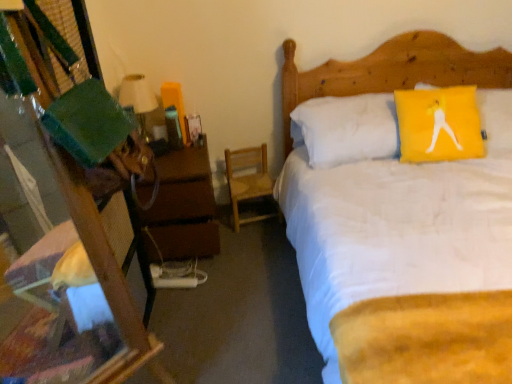
Identify the location of wooden desk at left. (56, 233).

What are the coordinates of `matte white lampshade at left` in the screenshot? It's located at (138, 100).

What do you see at coordinates (392, 70) in the screenshot? This screenshot has height=384, width=512. I see `white soft bed at upper right` at bounding box center [392, 70].

This screenshot has height=384, width=512. Find the location of `wooden chair at center`. wooden chair at center is located at coordinates (247, 180).

Locate an element on the screen. The width and height of the screenshot is (512, 384). wooden desk at left is located at coordinates (56, 233).

Consider the image. From the image's perspective, between brown wooden nightstand at left and white soft bed at upper right, which one is located above?

brown wooden nightstand at left.

Which object is thinner, brown wooden nightstand at left or white soft bed at upper right?

With smaller width is brown wooden nightstand at left.

From a real-world perspective, is brown wooden nightstand at left located beneath white soft bed at upper right?

Yes, from a real-world perspective, brown wooden nightstand at left is below white soft bed at upper right.

Does brown wooden nightstand at left have a smaller size compared to white soft bed at upper right?

Correct, brown wooden nightstand at left occupies less space than white soft bed at upper right.

How different are the orientations of wooden desk at left and wooden chair at center in degrees?

The angular difference between wooden desk at left and wooden chair at center is 36 degrees.

Is wooden desk at left positioned with its back to wooden chair at center?

No, wooden desk at left is not facing away from wooden chair at center.

Is wooden desk at left situated inside wooden chair at center or outside?

wooden desk at left cannot be found inside wooden chair at center.

From the image's perspective, is wooden desk at left beneath wooden chair at center?

Indeed, from the image's perspective, wooden desk at left is shown beneath wooden chair at center.

Could you tell me if wooden desk at left is facing white soft bed at upper right?

No, wooden desk at left is not turned towards white soft bed at upper right.

From a real-world perspective, between wooden desk at left and white soft bed at upper right, who is vertically lower?

white soft bed at upper right, from a real-world perspective.

From the image's perspective, which is below, wooden desk at left or white soft bed at upper right?

wooden desk at left is shown below in the image.

Is wooden desk at left to the right of white soft bed at upper right from the viewer's perspective?

In fact, wooden desk at left is to the left of white soft bed at upper right.

Which of these two, brown wooden nightstand at left or wooden chair at center, is bigger?

Bigger between the two is brown wooden nightstand at left.

Does brown wooden nightstand at left appear on the right side of wooden chair at center?

No.

At what (x,y) coordinates should I click in order to perform the action: click on chair on the right of the brown wooden nightstand at left. Please return your answer as a coordinate pair (x, y). Looking at the image, I should click on (247, 180).

Which is in front, matte white lampshade at left or wooden desk at left?

wooden desk at left is in front.

Are matte white lampshade at left and wooden desk at left located far from each other?

Yes.

The height and width of the screenshot is (384, 512). I want to click on desk in front of the matte white lampshade at left, so click(x=56, y=233).

Visually, is matte white lampshade at left positioned to the left or to the right of wooden desk at left?

matte white lampshade at left is positioned on wooden desk at left's left side.

Is point (146, 140) more distant than point (290, 107)?

No, it is in front of (290, 107).

From a real-world perspective, relative to white soft bed at upper right, is matte white lampshade at left vertically above or below?

In terms of real-world spatial position, matte white lampshade at left is above white soft bed at upper right.

From the image's perspective, which one is positioned higher, matte white lampshade at left or white soft bed at upper right?

matte white lampshade at left, from the image's perspective.

Is matte white lampshade at left facing towards white soft bed at upper right?

No, matte white lampshade at left is not oriented towards white soft bed at upper right.

Is wooden chair at center further to camera compared to white soft bed at upper right?

Yes.

Is wooden chair at center next to white soft bed at upper right?

No, wooden chair at center is not next to white soft bed at upper right.

Which of these two, wooden chair at center or white soft bed at upper right, stands shorter?

Standing shorter between the two is wooden chair at center.

Can you tell me how much wooden chair at center and white soft bed at upper right differ in facing direction?

10 degrees.

Locate an element on the screen. bed in front of the brown wooden nightstand at left is located at coordinates (392, 70).

At what (x,y) coordinates should I click in order to perform the action: click on chair below the wooden desk at left (from a real-world perspective). Please return your answer as a coordinate pair (x, y). The height and width of the screenshot is (384, 512). Looking at the image, I should click on (247, 180).

When comparing their distances from white soft bed at upper right, does matte white lampshade at left or wooden chair at center seem closer?

The object closer to white soft bed at upper right is wooden chair at center.

Considering their positions, is wooden chair at center positioned closer to brown wooden nightstand at left than wooden desk at left?

Among the two, wooden chair at center is located nearer to brown wooden nightstand at left.

Which object lies further to the anchor point white soft bed at upper right, brown wooden nightstand at left or wooden desk at left?

The object further to white soft bed at upper right is wooden desk at left.

Considering their positions, is wooden chair at center positioned closer to brown wooden nightstand at left than white soft bed at upper right?

wooden chair at center is positioned closer to the anchor brown wooden nightstand at left.

From the image, which object appears to be farther from white soft bed at upper right, wooden desk at left or brown wooden nightstand at left?

Among the two, wooden desk at left is located further to white soft bed at upper right.

Considering their positions, is white soft bed at upper right positioned further to brown wooden nightstand at left than wooden chair at center?

white soft bed at upper right is positioned further to the anchor brown wooden nightstand at left.

From the picture: Looking at the image, which one is located closer to matte white lampshade at left, white soft bed at upper right or wooden desk at left?

white soft bed at upper right lies closer to matte white lampshade at left than the other object.

When comparing their distances from white soft bed at upper right, does wooden chair at center or brown wooden nightstand at left seem closer?

Based on the image, wooden chair at center appears to be nearer to white soft bed at upper right.

This screenshot has height=384, width=512. What are the coordinates of `desk between white soft bed at upper right and matte white lampshade at left from front to back` in the screenshot? It's located at (56, 233).

Where is `lamp between wooden desk at left and wooden chair at center in the front-back direction`? This screenshot has width=512, height=384. lamp between wooden desk at left and wooden chair at center in the front-back direction is located at coordinates (138, 100).

Where is `nightstand located between wooden desk at left and wooden chair at center in the depth direction`? nightstand located between wooden desk at left and wooden chair at center in the depth direction is located at coordinates (184, 206).

This screenshot has height=384, width=512. What are the coordinates of `desk between white soft bed at upper right and brown wooden nightstand at left from front to back` in the screenshot? It's located at (56, 233).